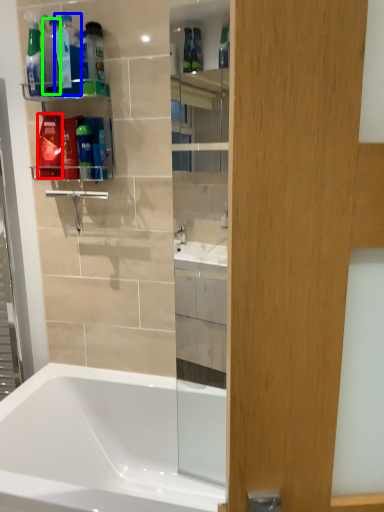
Question: Which object is positioned farthest from mouthwash (highlighted by a red box)? Select from cleaning product (highlighted by a blue box) and bottle (highlighted by a green box).

Choices:
 (A) cleaning product
 (B) bottle

Answer: (A)